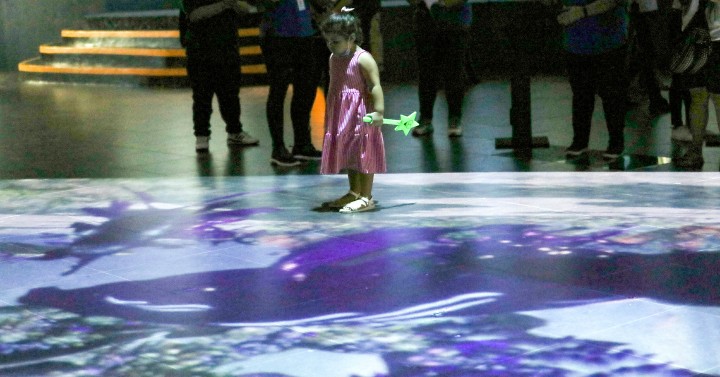
Find the location of a particular element. stairs is located at coordinates (147, 60).